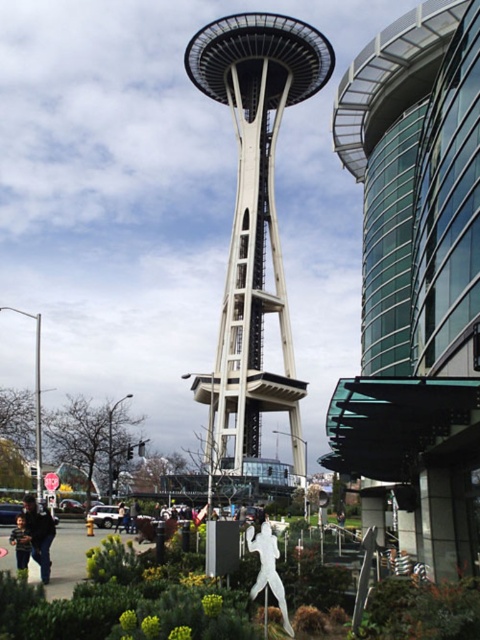
Question: Which object appears farthest from the camera in this image?

Choices:
 (A) dark blue jeans at lower left
 (B) white concrete space needle at center
 (C) transparent glass building at upper right

Answer: (B)

Question: Which point appears closest to the camera in this image?

Choices:
 (A) (49, 515)
 (B) (26, 552)

Answer: (B)

Question: Does dark blue jeans at lower left have a larger size compared to matte black jacket at lower left?

Choices:
 (A) no
 (B) yes

Answer: (B)

Question: Does white concrete space needle at center appear on the left side of dark blue jeans at lower left?

Choices:
 (A) no
 (B) yes

Answer: (A)

Question: Is transparent glass building at upper right behind skinny jeans at center?

Choices:
 (A) no
 (B) yes

Answer: (A)

Question: Estimate the real-world distances between objects in this image. Which object is farther from the skinny jeans at center?

Choices:
 (A) transparent glass building at upper right
 (B) white concrete space needle at center
 (C) matte black jacket at lower left
 (D) dark blue jeans at lower left

Answer: (A)